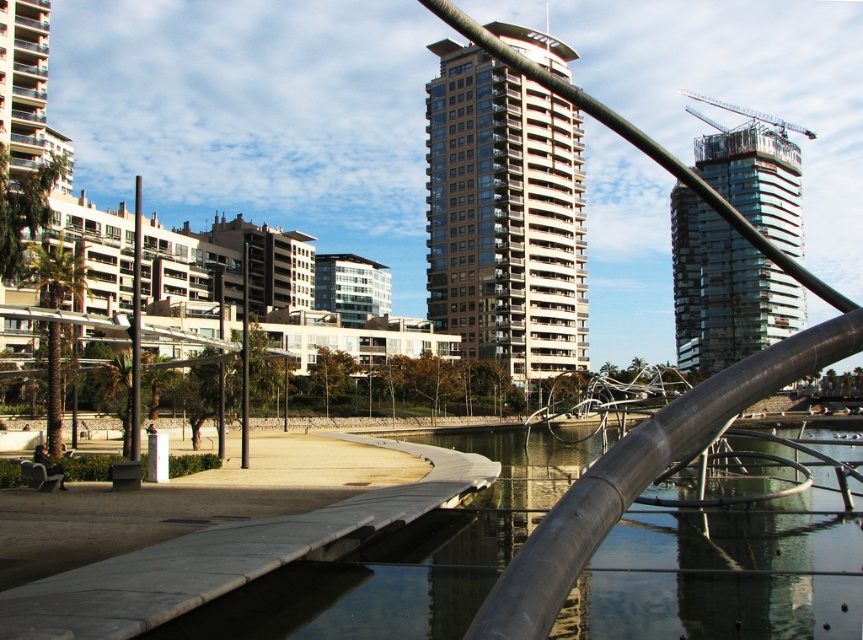
Looking at this image, you are a city planner evaluating the urban space. You need to install a new bench that must be placed between the beige glass building at center and the black metal pole at center. Given their sizes, which object should the bench be closer to for better spatial balance?

The bench should be closer to the black metal pole at center because the beige glass building at center is larger in size, so placing the bench closer to the smaller object balances the visual weight.

You are a city planner reviewing this waterfront design. You need to determine if the black metal pole at center will block the view of the beige glass building at center from the walkway. Based on their heights, can you confirm if the pole will obscure the building?

The beige glass building at center is taller than the black metal pole at center, so the pole will not block the view of the building from the walkway.

You are standing on the curved concrete walkway in the urban waterfront scene. You see the beige glass building at center and the black metal pole at center. Which object is higher from the ground?

The beige glass building at center is located above the black metal pole at center, so the beige glass building at center is higher from the ground.